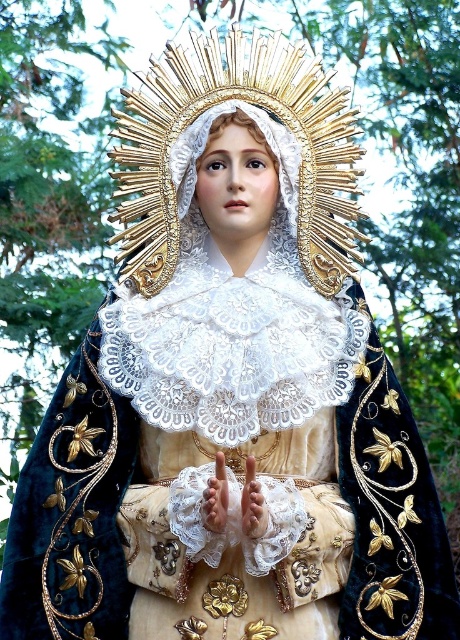
Question: Which of the following is the farthest from the observer?

Choices:
 (A) (251, 477)
 (B) (286, 84)

Answer: (B)

Question: Which point appears closest to the camera in this image?

Choices:
 (A) (247, 508)
 (B) (207, 500)

Answer: (B)

Question: Can you confirm if gold textured halo at center is thinner than smooth white hand at center?

Choices:
 (A) yes
 (B) no

Answer: (B)

Question: Does gold textured halo at center appear on the left side of smooth white hand at center?

Choices:
 (A) no
 (B) yes

Answer: (A)

Question: Which of these objects is positioned farthest from the gold textured halo at center?

Choices:
 (A) gold textured hand at center
 (B) smooth white hand at center

Answer: (A)

Question: Is gold textured halo at center closer to camera compared to gold textured hand at center?

Choices:
 (A) no
 (B) yes

Answer: (A)